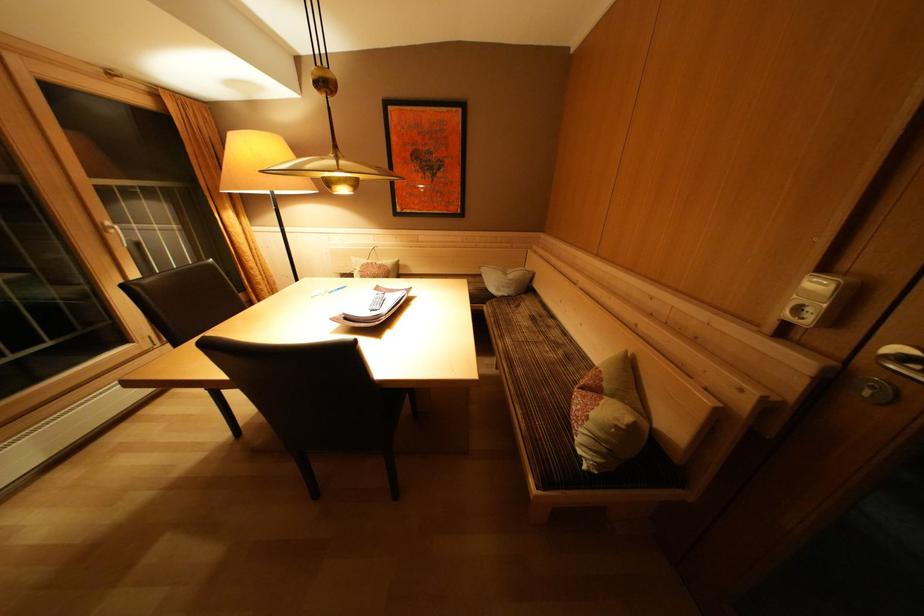
The height and width of the screenshot is (616, 924). What do you see at coordinates (114, 231) in the screenshot?
I see `the white window handle` at bounding box center [114, 231].